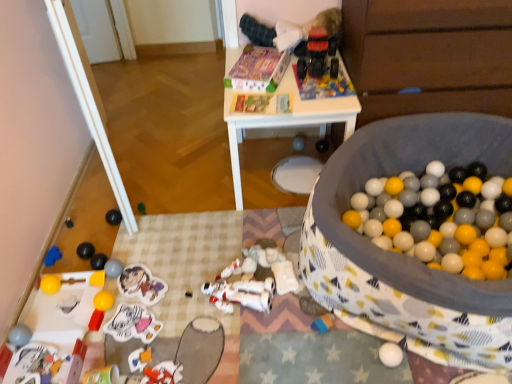
Identify the location of free space between matte white sticker at center, the fourteenth toy when ordered from left to right, and matte gray ball at lower left, which appears as the 12th toy when viewed from the right. Image resolution: width=512 pixels, height=384 pixels. (128, 297).